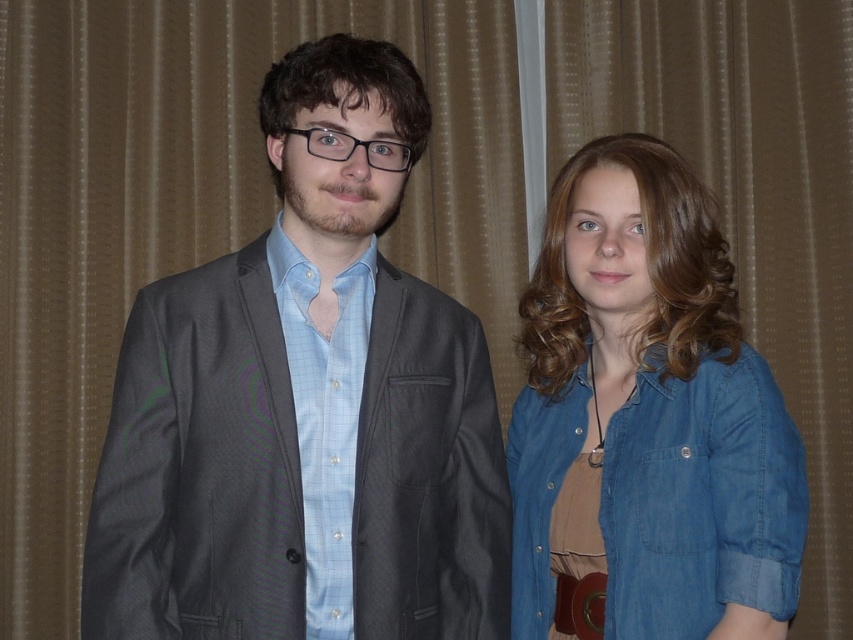
You are an artist trying to paint this scene. You want to ensure depth perception by using perspective. Which of the two points, point (194, 532) or point (584, 417), should you make appear larger to indicate it is closer to the viewer?

Point (194, 532) is closer to the viewer than point (584, 417), so you should make point (194, 532) appear larger to indicate its proximity.

You are a photographer setting up for a portrait shoot. You want to ensure that the matte gray blazer at center and the denim shirt at right are clearly visible in the frame. Given that your camera has a depth of field that can sharply focus on objects within 10 inches of each other, will both items remain in focus?

The matte gray blazer at center is 11.11 inches from the denim shirt at right. Since the distance exceeds the camera s 10 inch depth of field range, both items may not remain in focus simultaneously.

You are a photographer setting up for a portrait. You need to ensure that the matte gray blazer at center and the denim shirt at right are both in frame. Based on their positions, which direction should you adjust your camera to include both items without moving the subjects?

Since the matte gray blazer at center is to the left of the denim shirt at right, you should adjust the camera slightly to the left to ensure both the matte gray blazer at center and the denim shirt at right are fully in frame.